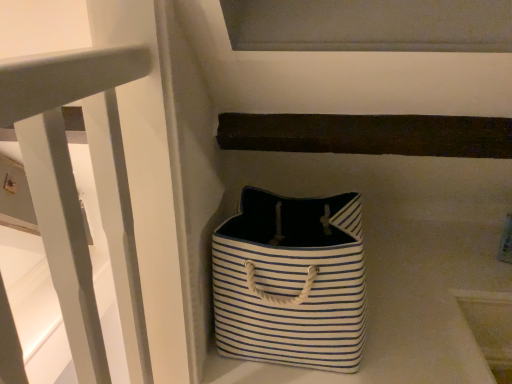
Image resolution: width=512 pixels, height=384 pixels. What do you see at coordinates (291, 281) in the screenshot?
I see `white striped fabric bag at center` at bounding box center [291, 281].

I want to click on white striped fabric bag at center, so click(291, 281).

This screenshot has width=512, height=384. Find the location of `white striped fabric bag at center`. white striped fabric bag at center is located at coordinates (291, 281).